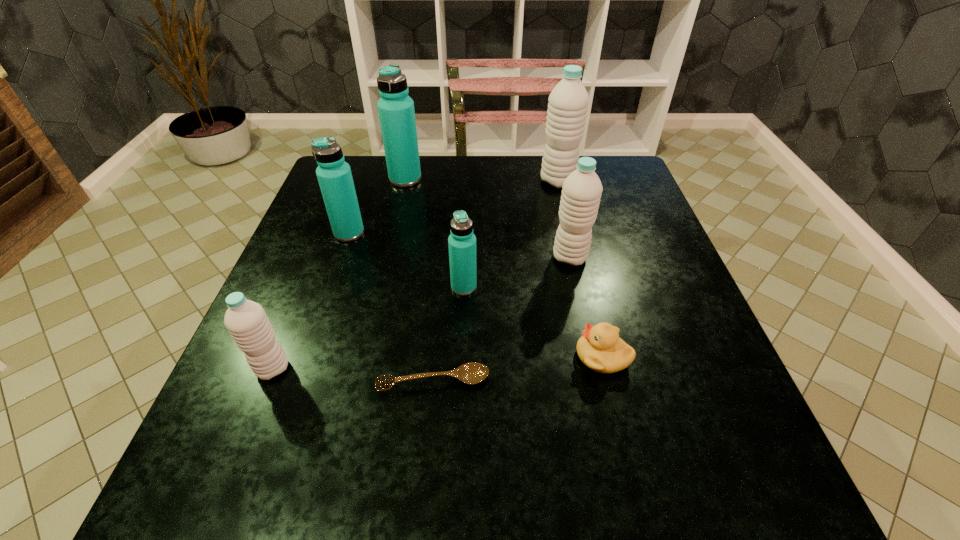
Locate an element on the screen. The width and height of the screenshot is (960, 540). the biggest white water bottle is located at coordinates (568, 103).

Where is `the farthest blue water bottle`? Image resolution: width=960 pixels, height=540 pixels. the farthest blue water bottle is located at coordinates (396, 111).

Where is `the fourth water bottle from right to left`? The image size is (960, 540). the fourth water bottle from right to left is located at coordinates (396, 111).

This screenshot has width=960, height=540. What are the coordinates of `the leftmost blue water bottle` in the screenshot? It's located at (334, 175).

Locate an element on the screen. The width and height of the screenshot is (960, 540). the second biggest blue water bottle is located at coordinates (334, 175).

Image resolution: width=960 pixels, height=540 pixels. I want to click on the second biggest white water bottle, so click(x=582, y=189).

This screenshot has height=540, width=960. Identify the location of the second nearest white water bottle. (582, 189).

Identify the location of the second nearest water bottle. (462, 242).

This screenshot has width=960, height=540. I want to click on the nearest blue water bottle, so click(462, 242).

At what (x,y) coordinates should I click in order to perform the action: click on the leftmost white water bottle. Please return your answer as a coordinate pair (x, y). Image resolution: width=960 pixels, height=540 pixels. Looking at the image, I should click on (246, 321).